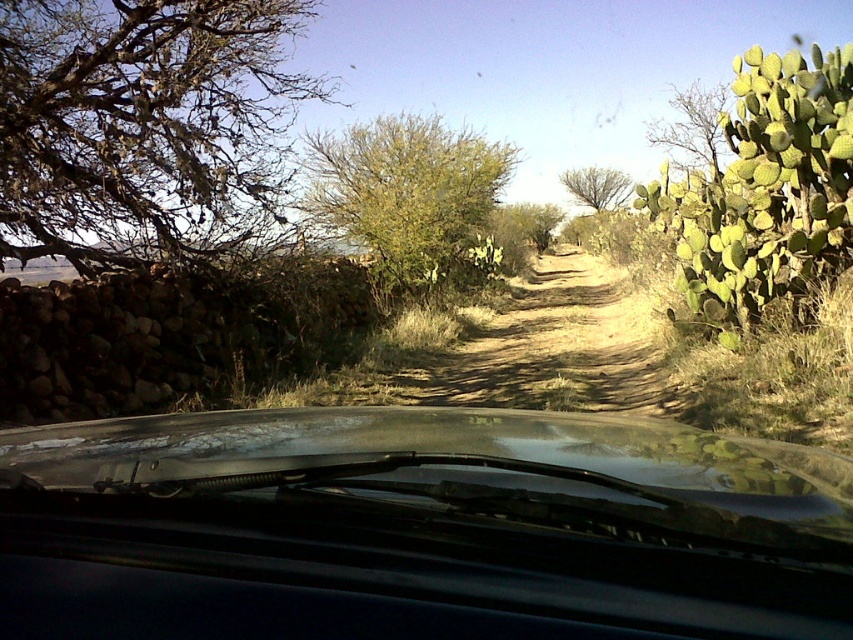
Question: Which of these objects is positioned farthest from the green spiny cactus at upper right?

Choices:
 (A) brown/dry wood tree at left
 (B) brown dirt track at center
 (C) green leafy bush at center
 (D) green spiny cactus at right

Answer: (A)

Question: Does green spiny cactus at right lie behind brown leafy tree at center?

Choices:
 (A) no
 (B) yes

Answer: (A)

Question: Considering the real-world distances, which object is closest to the green spiny cactus at upper right?

Choices:
 (A) green spiny cactus at right
 (B) brown dirt track at center

Answer: (A)

Question: Estimate the real-world distances between objects in this image. Which object is closer to the green leafy tree at center?

Choices:
 (A) transparent glass windshield at center
 (B) green spiny cactus at right

Answer: (B)

Question: Does transparent glass windshield at center have a smaller size compared to brown leafy tree at center?

Choices:
 (A) yes
 (B) no

Answer: (A)

Question: Can you confirm if brown/dry wood tree at left is positioned above brown leafy tree at center?

Choices:
 (A) no
 (B) yes

Answer: (A)